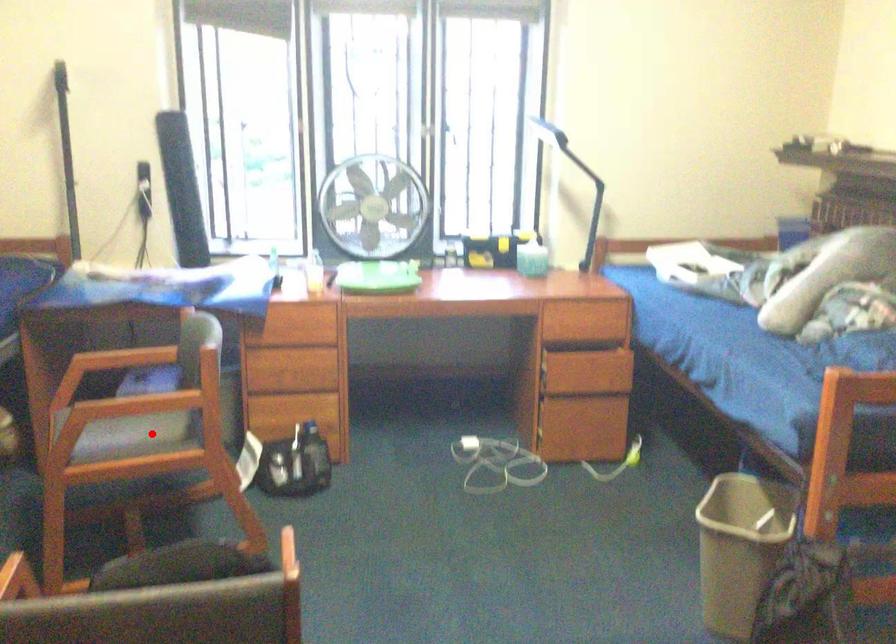
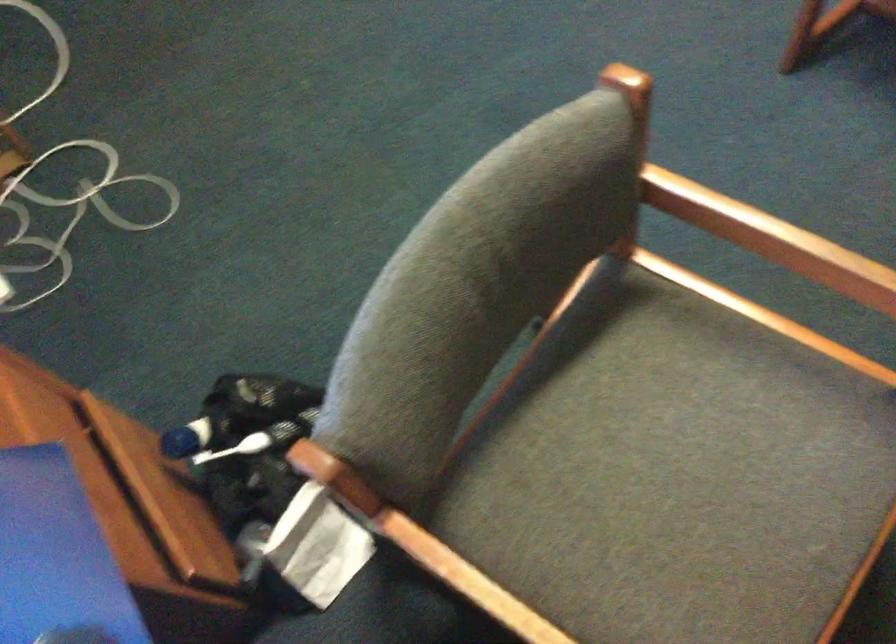
Question: A red point is marked in image1. In image2, is the corresponding 3D point closer to the camera or farther? Reply with the corresponding letter.

Choices:
 (A) The corresponding 3D point is closer.
 (B) The corresponding 3D point is farther.

Answer: (A)